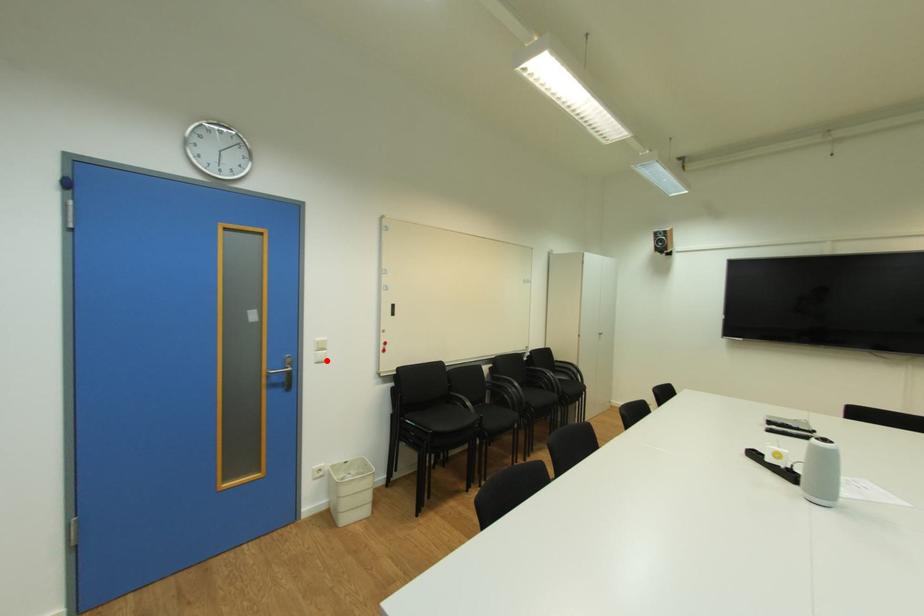
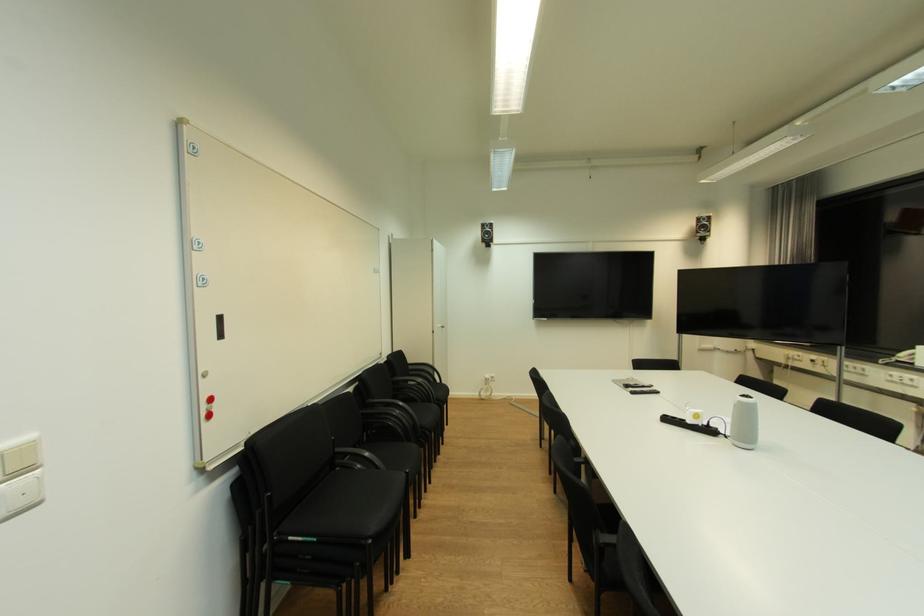
The point at the highlighted location is marked in the first image. Where is the corresponding point in the second image?

(26, 505)